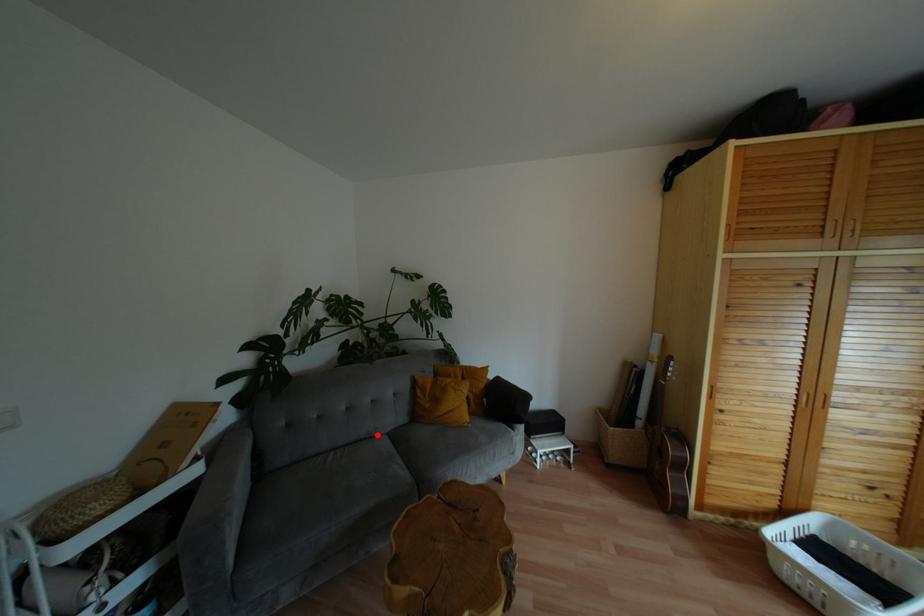
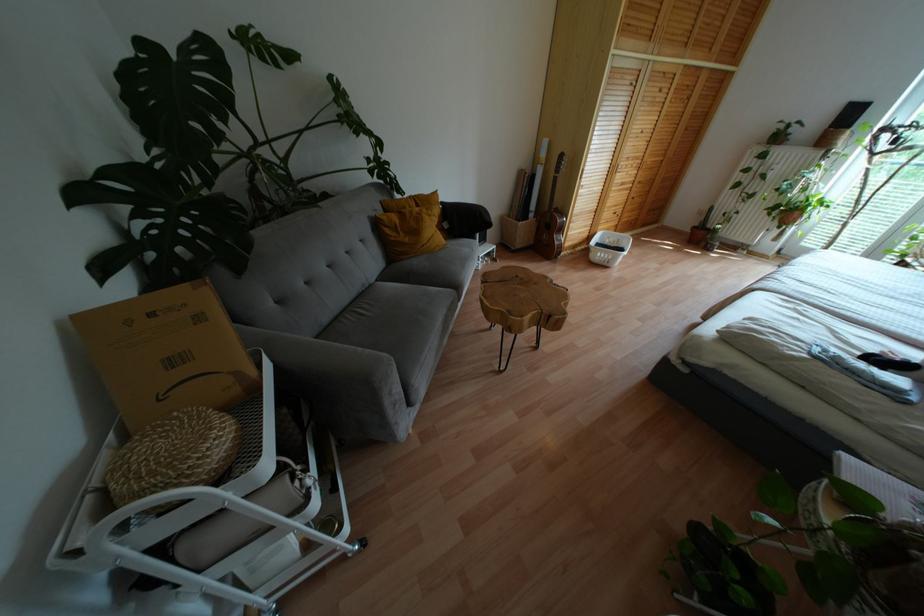
Question: I am providing you with two images of the same scene from different viewpoints. A red point is shown in image1. For the corresponding object point in image2, is it positioned nearer or farther from the camera?

Choices:
 (A) Nearer
 (B) Farther

Answer: (A)